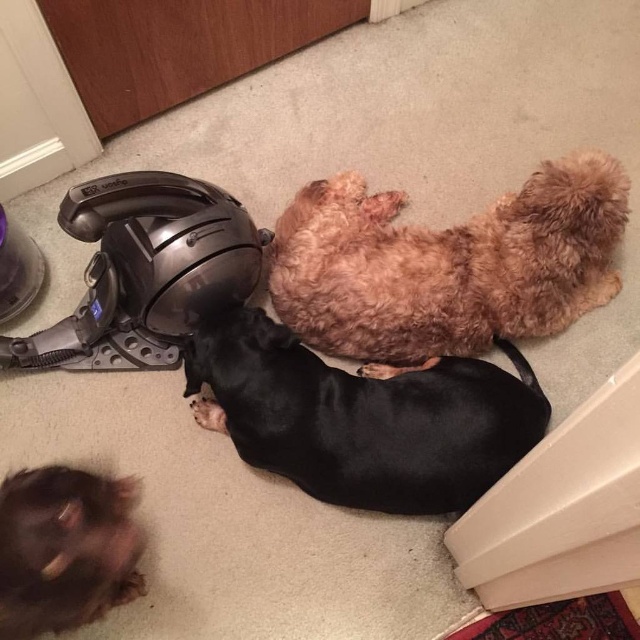
Question: Which of these objects is positioned closest to the fuzzy brown dog at center?

Choices:
 (A) brown fluffy dog at lower left
 (B) black smooth dog at center

Answer: (B)

Question: Which is farther from the brushed metal vacuum cleaner at center?

Choices:
 (A) fuzzy brown dog at center
 (B) brown fluffy dog at lower left

Answer: (B)

Question: Does fuzzy brown dog at center lie behind brushed metal vacuum cleaner at center?

Choices:
 (A) yes
 (B) no

Answer: (A)

Question: Which of the following is the closest to the observer?

Choices:
 (A) fuzzy brown dog at center
 (B) brushed metal vacuum cleaner at center

Answer: (B)

Question: Does fuzzy brown dog at center lie in front of black smooth dog at center?

Choices:
 (A) no
 (B) yes

Answer: (A)

Question: Can you confirm if black smooth dog at center is positioned to the right of brushed metal vacuum cleaner at center?

Choices:
 (A) no
 (B) yes

Answer: (B)